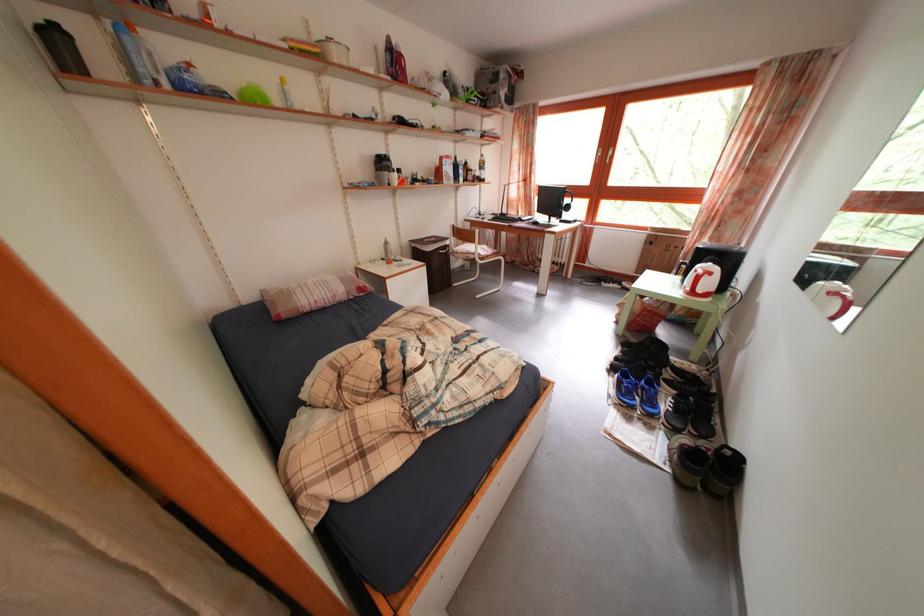
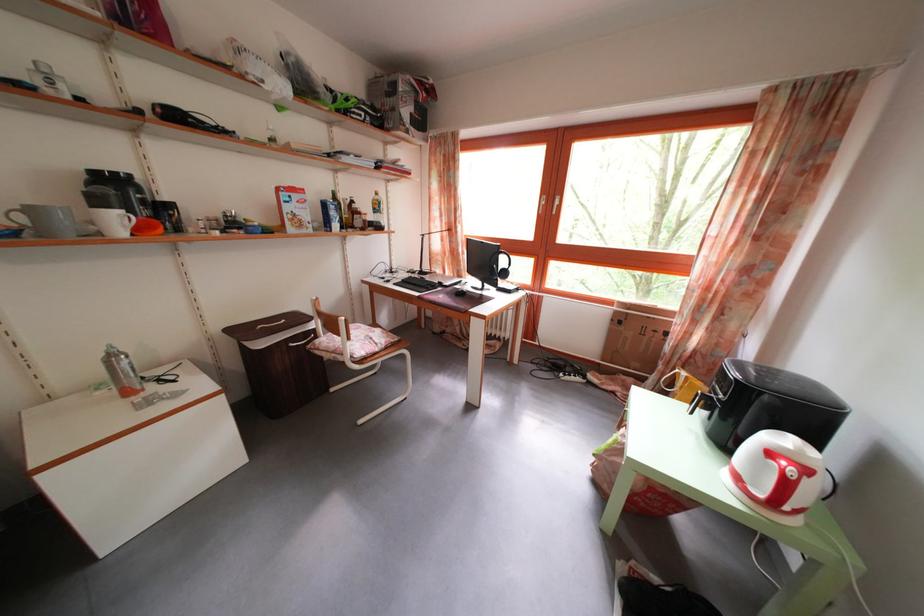
In the second image, find the point that corresponds to the point at 718,281 in the first image.

(812, 477)